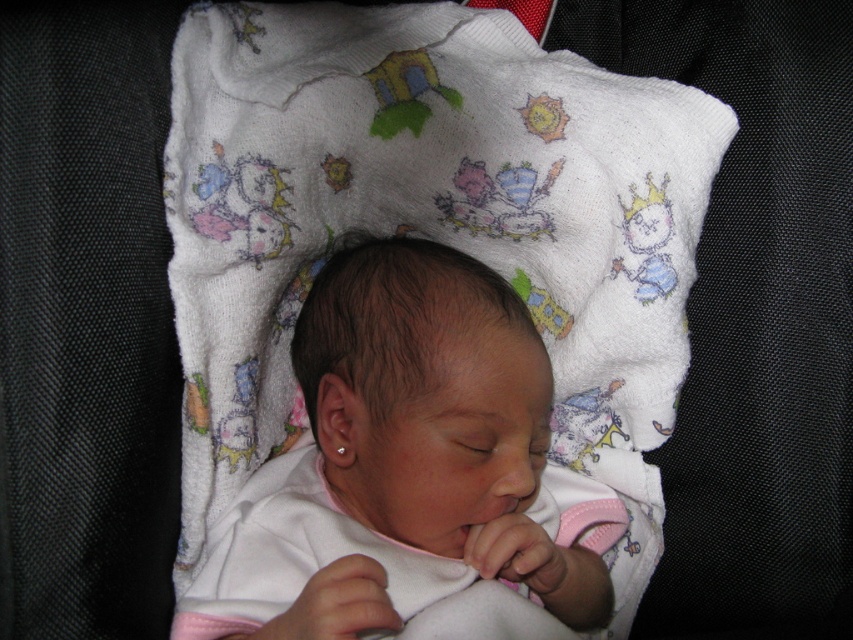
In the scene shown: You are a nurse checking on a newborn baby. You notice the smooth pink fabric at center and the clear plastic teething ring at center. Which item is bigger in size?

The smooth pink fabric at center is larger in size than the clear plastic teething ring at center.

You are a parent holding a newborn baby. You notice the smooth pink fabric at center and the clear plastic teething ring at center. Which item is closer to the baby when they are lying on their back?

The smooth pink fabric at center is above the clear plastic teething ring at center, so the smooth pink fabric at center is closer to the baby when they are lying on their back.